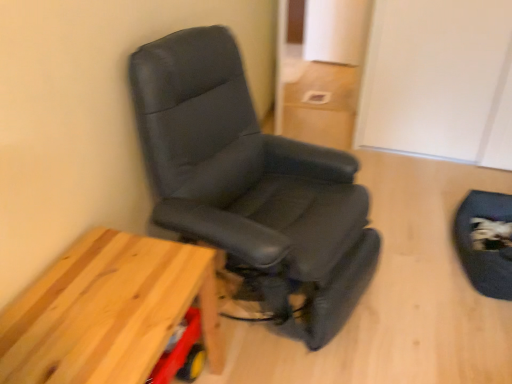
Where is `black leather swivel chair at lower right`? This screenshot has width=512, height=384. black leather swivel chair at lower right is located at coordinates (486, 242).

I want to click on chair that appears above the wooden table at lower left (from a real-world perspective), so click(251, 186).

Is black leather chair at left shorter than wooden table at lower left?

No, black leather chair at left is not shorter than wooden table at lower left.

From the image's perspective, does black leather chair at left appear lower than wooden table at lower left?

No.

Where is `chair that is on the left side of black leather swivel chair at lower right`? The width and height of the screenshot is (512, 384). chair that is on the left side of black leather swivel chair at lower right is located at coordinates (251, 186).

From the image's perspective, does black leather swivel chair at lower right appear lower than black leather chair at left?

Indeed, from the image's perspective, black leather swivel chair at lower right is shown beneath black leather chair at left.

Which of these two, black leather swivel chair at lower right or black leather chair at left, stands taller?

black leather chair at left is taller.

Does black leather swivel chair at lower right turn towards black leather chair at left?

Yes, black leather swivel chair at lower right faces towards black leather chair at left.

In the scene shown: How much distance is there between black leather chair at left and black leather swivel chair at lower right?

black leather chair at left and black leather swivel chair at lower right are 37.86 inches apart from each other.

Is black leather chair at left in front of or behind black leather swivel chair at lower right in the image?

In the image, black leather chair at left appears in front of black leather swivel chair at lower right.

Considering the relative sizes of black leather chair at left and black leather swivel chair at lower right in the image provided, is black leather chair at left thinner than black leather swivel chair at lower right?

Incorrect, the width of black leather chair at left is not less than that of black leather swivel chair at lower right.

Is black leather chair at left inside the boundaries of black leather swivel chair at lower right, or outside?

The correct answer is: outside.

Is wooden table at lower left positioned before black leather swivel chair at lower right?

Yes, wooden table at lower left is closer to the camera.

What's the angular difference between wooden table at lower left and black leather swivel chair at lower right's facing directions?

wooden table at lower left and black leather swivel chair at lower right are facing 175 degrees away from each other.

Considering the sizes of objects wooden table at lower left and black leather swivel chair at lower right in the image provided, who is wider, wooden table at lower left or black leather swivel chair at lower right?

With larger width is wooden table at lower left.

Which object is positioned more to the right, wooden table at lower left or black leather swivel chair at lower right?

Positioned to the right is black leather swivel chair at lower right.

Image resolution: width=512 pixels, height=384 pixels. Identify the location of chair behind the wooden table at lower left. (251, 186).

Can you confirm if wooden table at lower left is positioned to the left of black leather chair at left?

Indeed, wooden table at lower left is positioned on the left side of black leather chair at left.

From a real-world perspective, is wooden table at lower left located higher than black leather chair at left?

No, from a real-world perspective, wooden table at lower left is not over black leather chair at left

Based on the photo, is wooden table at lower left located outside black leather chair at left?

Yes, wooden table at lower left is outside of black leather chair at left.

From the image's perspective, would you say black leather swivel chair at lower right is shown under wooden table at lower left?

Actually, black leather swivel chair at lower right appears above wooden table at lower left in the image.

Which is less distant, (496, 277) or (113, 276)?

Point (496, 277) is farther from the camera than point (113, 276).

Is black leather swivel chair at lower right positioned behind wooden table at lower left?

Yes, it is.

Does black leather swivel chair at lower right have a greater width compared to wooden table at lower left?

No, black leather swivel chair at lower right is not wider than wooden table at lower left.

Find the location of a particular element. chair that appears above the wooden table at lower left (from the image's perspective) is located at coordinates (251, 186).

Locate an element on the screen. The width and height of the screenshot is (512, 384). swivel chair on the right of black leather chair at left is located at coordinates (486, 242).

Estimate the real-world distances between objects in this image. Which object is further from black leather swivel chair at lower right, black leather chair at left or wooden table at lower left?

wooden table at lower left.

Considering their positions, is black leather chair at left positioned closer to wooden table at lower left than black leather swivel chair at lower right?

black leather chair at left is positioned closer to the anchor wooden table at lower left.

From the image, which object appears to be farther from black leather swivel chair at lower right, wooden table at lower left or black leather chair at left?

wooden table at lower left.

Based on their spatial positions, is black leather swivel chair at lower right or wooden table at lower left closer to black leather chair at left?

The object closer to black leather chair at left is wooden table at lower left.

Looking at this image, looking at the image, which one is located further to wooden table at lower left, black leather swivel chair at lower right or black leather chair at left?

Based on the image, black leather swivel chair at lower right appears to be further to wooden table at lower left.

Looking at the image, which one is located further to black leather chair at left, wooden table at lower left or black leather swivel chair at lower right?

black leather swivel chair at lower right is further to black leather chair at left.

The width and height of the screenshot is (512, 384). In order to click on chair located between wooden table at lower left and black leather swivel chair at lower right in the left-right direction in this screenshot , I will do `click(251, 186)`.